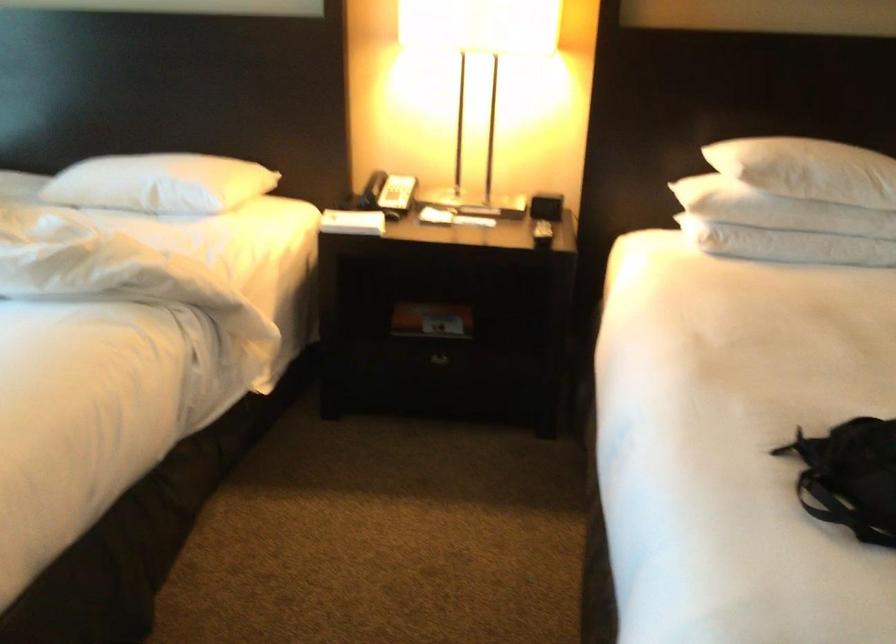
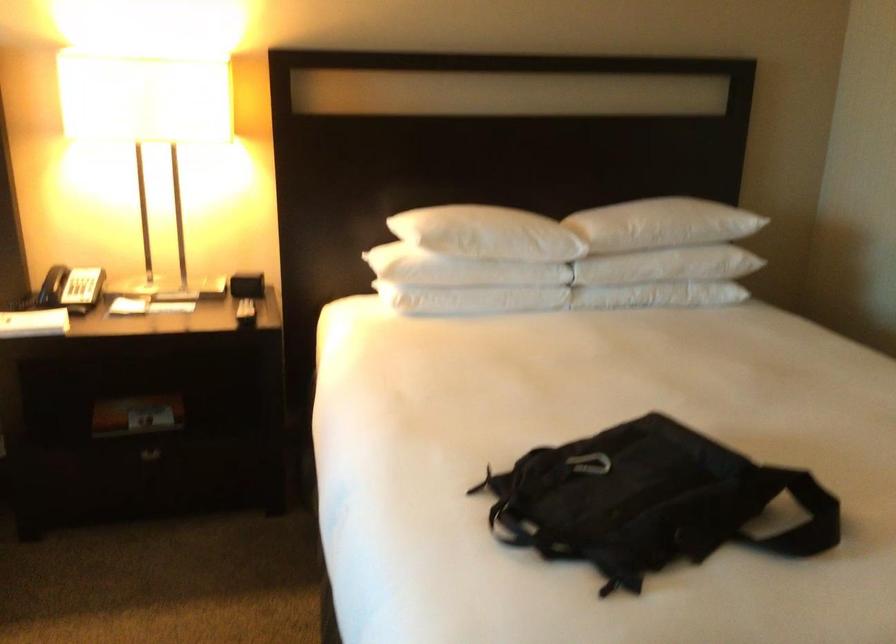
Locate, in the second image, the point that corresponds to the point at 780,205 in the first image.

(460, 270)